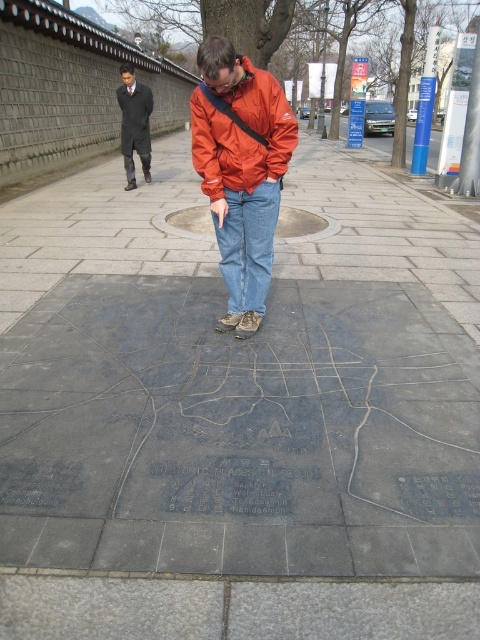
Question: Which object is farther from the camera taking this photo?

Choices:
 (A) dark gray coat at upper left
 (B) orange nylon jacket at center
 (C) denim at center
 (D) orange matte jacket at center

Answer: (A)

Question: Does orange nylon jacket at center have a greater width compared to orange matte jacket at center?

Choices:
 (A) no
 (B) yes

Answer: (B)

Question: Does denim at center appear on the left side of dark gray coat at upper left?

Choices:
 (A) no
 (B) yes

Answer: (A)

Question: Which of the following is the farthest from the observer?

Choices:
 (A) denim at center
 (B) orange matte jacket at center
 (C) orange nylon jacket at center

Answer: (A)

Question: Which of the following is the closest to the observer?

Choices:
 (A) (149, 144)
 (B) (230, 268)
 (C) (264, 109)
 (D) (226, 45)

Answer: (D)

Question: Does denim at center appear over dark gray coat at upper left?

Choices:
 (A) no
 (B) yes

Answer: (A)